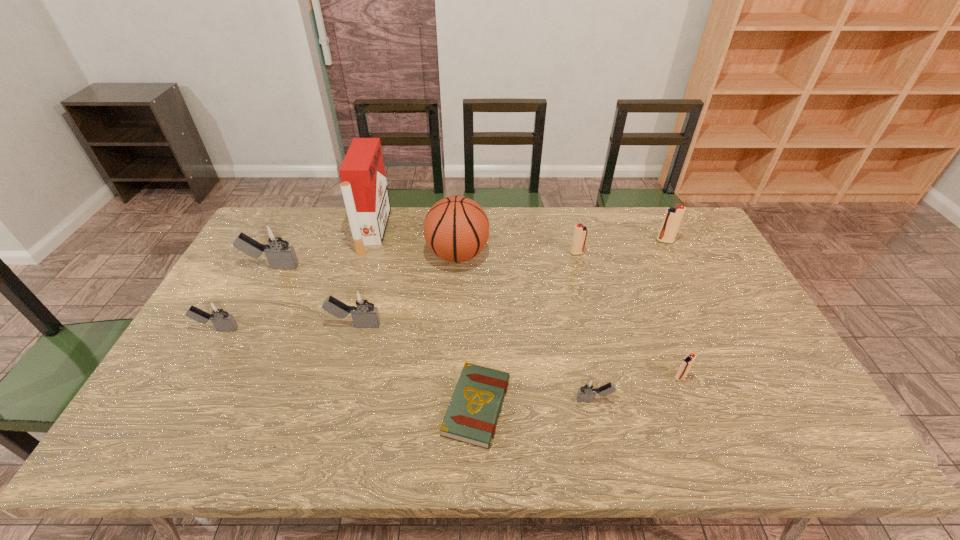
This screenshot has height=540, width=960. What are the coordinates of `cigarette case` in the screenshot? It's located at (364, 187).

Identify the location of the tallest object. (364, 187).

You are a GUI agent. You are given a task and a screenshot of the screen. Output one action in this format:
    pyautogui.click(x=<x>, y=<y>)
    Task: Click on the basketball
    The height and width of the screenshot is (540, 960).
    Given the screenshot: What is the action you would take?
    pyautogui.click(x=456, y=229)

Where is `orange basketball`? The image size is (960, 540). orange basketball is located at coordinates (456, 229).

Image resolution: width=960 pixels, height=540 pixels. I want to click on the tallest igniter, so click(x=275, y=243).

Where is `the third tallest object`? This screenshot has height=540, width=960. the third tallest object is located at coordinates (275, 243).

Where is `the rightmost igniter`? This screenshot has height=540, width=960. the rightmost igniter is located at coordinates (673, 216).

I want to click on the farthest igniter, so click(x=673, y=216).

The width and height of the screenshot is (960, 540). In order to click on the second gray igniter from right to left in this screenshot , I will do `click(364, 312)`.

Where is `the third igniter from left to right`? the third igniter from left to right is located at coordinates (364, 312).